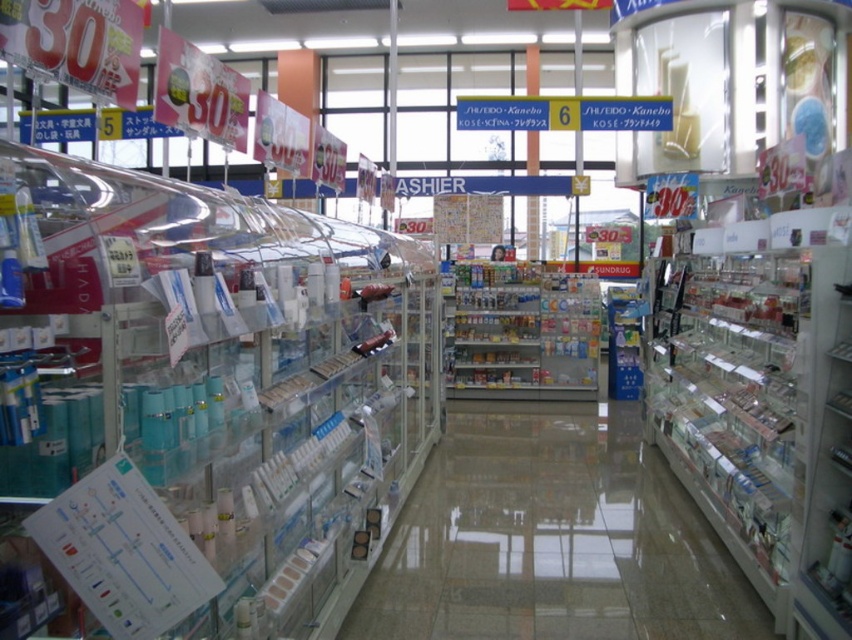
Question: Which point is farther from the camera taking this photo?

Choices:
 (A) (101, 634)
 (B) (540, 451)

Answer: (B)

Question: Can you confirm if clear plastic bottles at left is thinner than transparent plastic shelves at center?

Choices:
 (A) yes
 (B) no

Answer: (A)

Question: Which of the following is the farthest from the observer?

Choices:
 (A) transparent plastic shelves at center
 (B) clear plastic bottles at left

Answer: (A)

Question: Considering the relative positions of clear plastic bottles at left and transparent plastic shelves at center in the image provided, where is clear plastic bottles at left located with respect to transparent plastic shelves at center?

Choices:
 (A) left
 (B) right

Answer: (A)

Question: Is clear plastic bottles at left bigger than transparent plastic shelves at center?

Choices:
 (A) no
 (B) yes

Answer: (B)